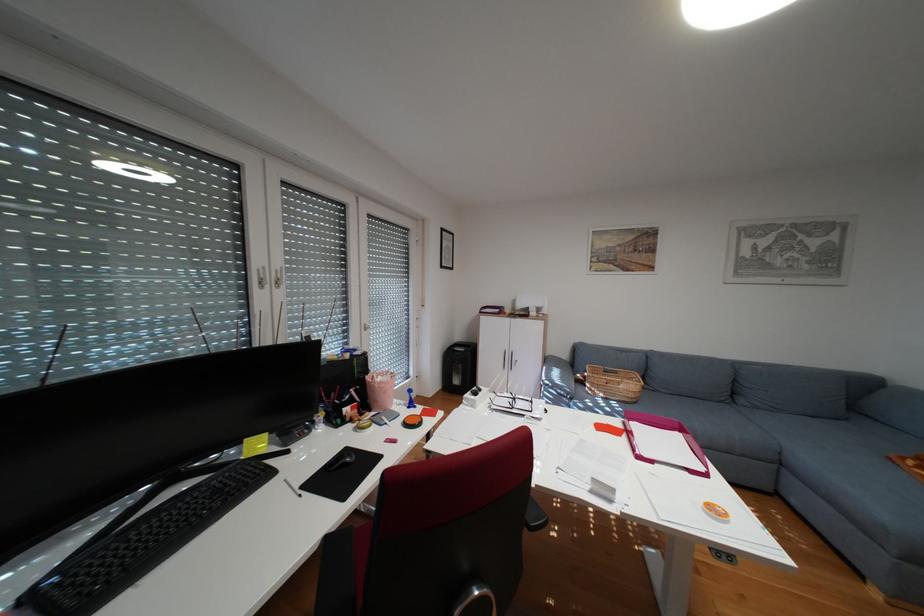
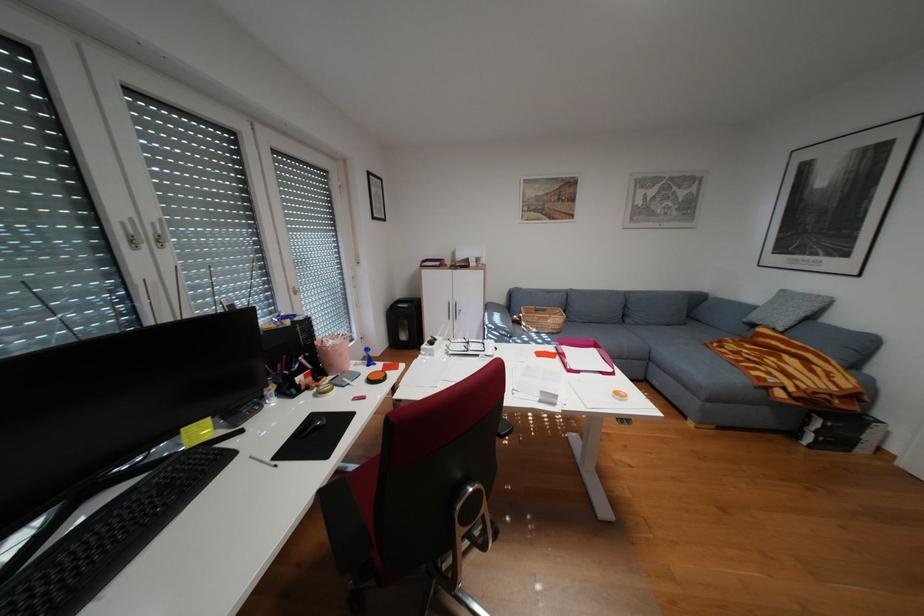
Where in the second image is the point corresponding to (280,285) from the first image?

(156, 245)